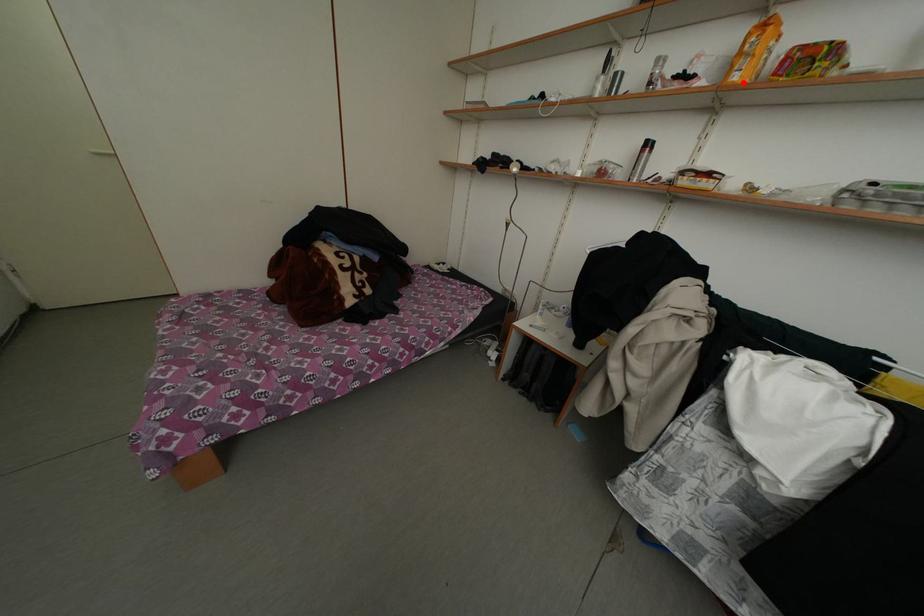
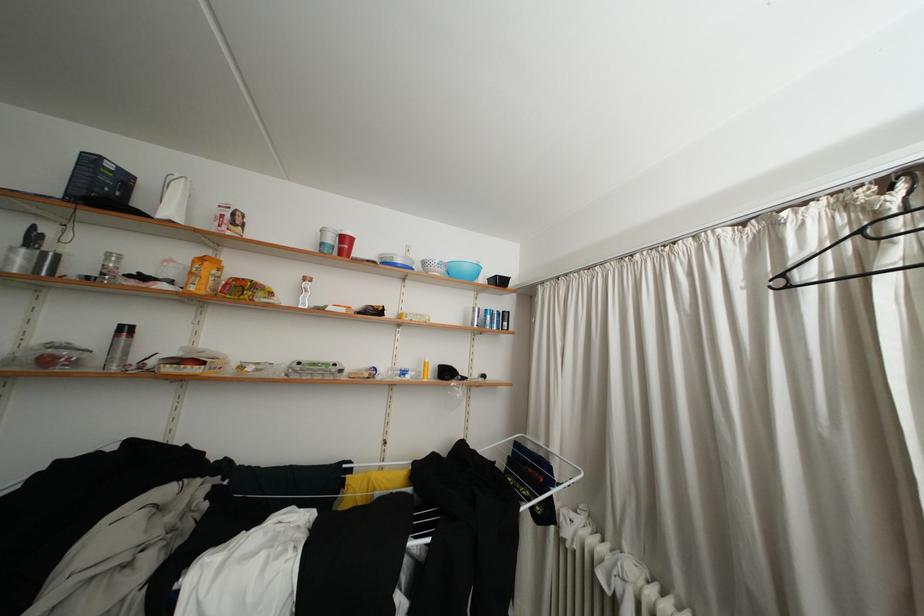
In the second image, find the point that corresponds to the highlighted location in the first image.

(200, 294)